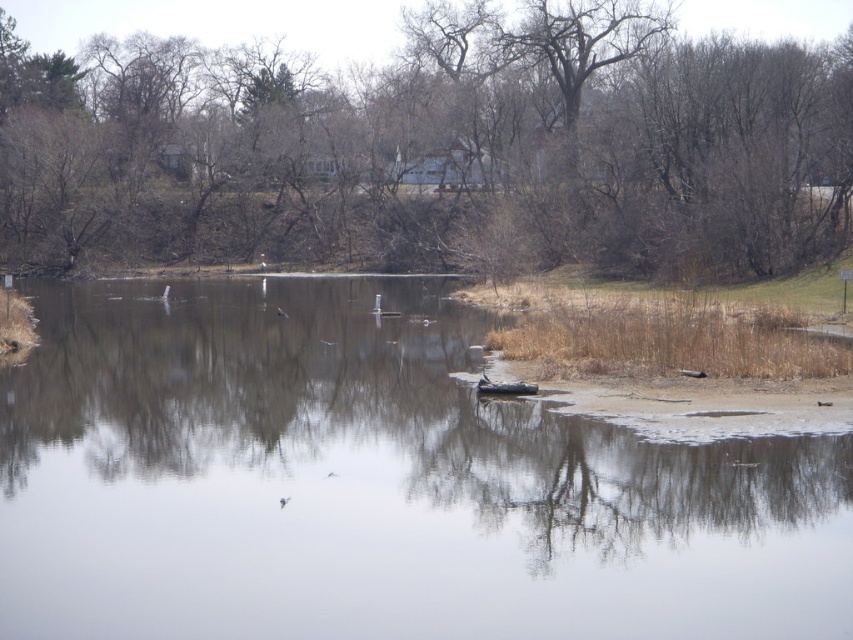
Question: From the image, what is the correct spatial relationship of transparent ice at center in relation to rubberized black boat at center?

Choices:
 (A) left
 (B) right

Answer: (A)

Question: Is brown leafless tree at center wider than rubberized black boat at center?

Choices:
 (A) no
 (B) yes

Answer: (B)

Question: Does brown leafless tree at center have a smaller size compared to rubberized black boat at center?

Choices:
 (A) no
 (B) yes

Answer: (A)

Question: Which point appears closest to the camera in this image?

Choices:
 (A) coord(234,250)
 (B) coord(846,490)
 (C) coord(509,394)

Answer: (B)

Question: Which object is positioned closest to the transparent ice at center?

Choices:
 (A) brown leafless tree at center
 (B) rubberized black boat at center

Answer: (B)

Question: Which is farther from the brown leafless tree at center?

Choices:
 (A) transparent ice at center
 (B) rubberized black boat at center

Answer: (B)